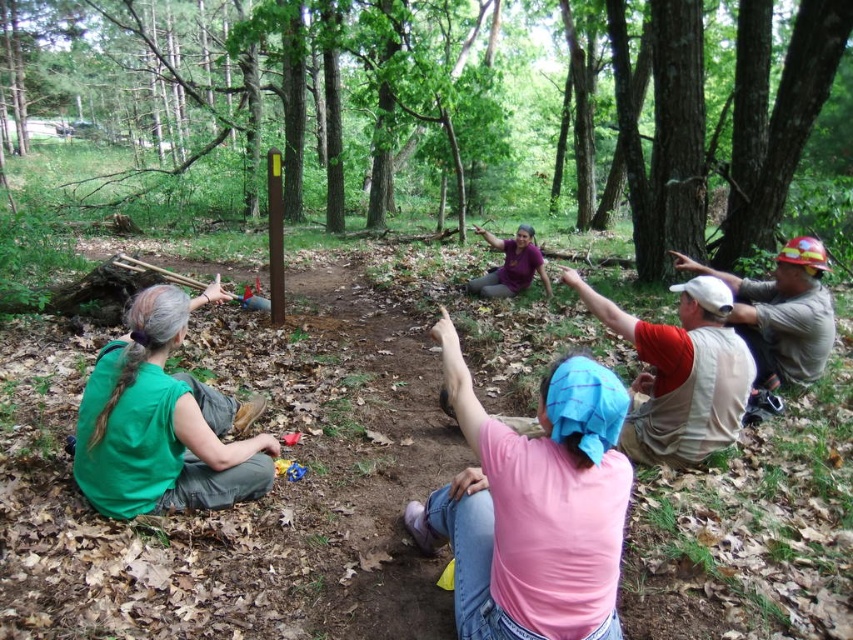
You are standing at the point labeled point at (193, 227) and need to reach a tree located 9.66 meters away. What direction should you walk to reach the tree?

The tree is 9.66 meters away from the point labeled point at (193, 227), so you should walk in the direction away from the group towards the tree.

You are part of the group in the wooded area and need to locate the person wearing the pink fabric headscarf at center. Based on the coordinates provided, can you determine their position relative to the yellow post in the center of the group?

The pink fabric headscarf at center is located at point coordinates that are very close to the yellow post in the center of the group, so the person is likely positioned near the central area where the post is located.